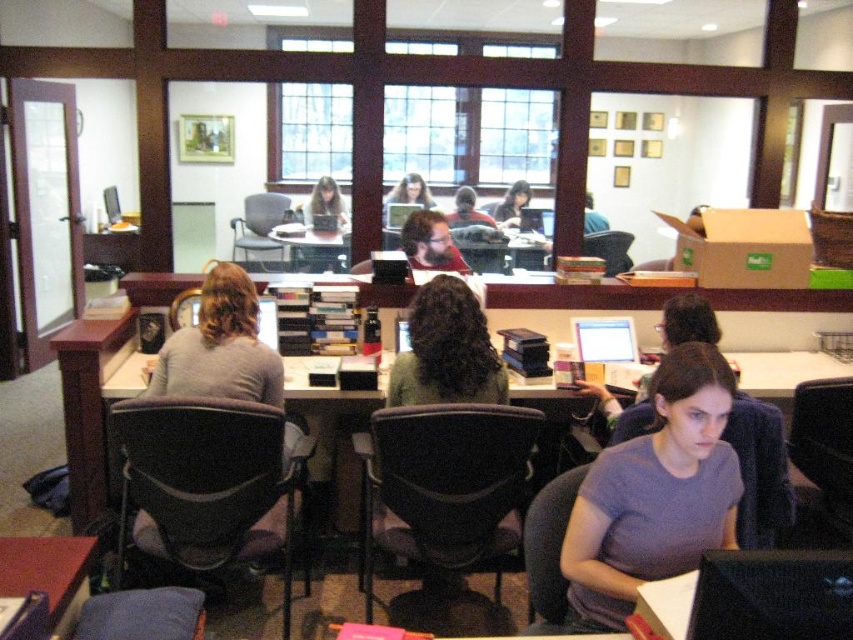
You are a student sitting at a desk in the library. You need to reach for your matte black laptop at center to continue working, but there is a gray sweater at left in your way. Can you move the sweater to access your laptop?

The gray sweater at left is to the left of the matte black laptop at center, so you can move the sweater to the side to access your laptop.

Looking at this image, you are a photographer taking a photo of the purple matte shirt at center and the matte black laptop at center. Which object will appear larger in your photo?

The purple matte shirt at center will appear larger in the photo because it has a larger size compared to the matte black laptop at center.

You are a student trying to decide whether to place your laptop on the gray sweater at left or the matte black monitor at center. Based on their sizes, which surface would be more stable for placing your laptop?

The gray sweater at left has a larger size compared to the matte black monitor at center, so placing the laptop on the gray sweater at left would provide a more stable surface due to its greater size.